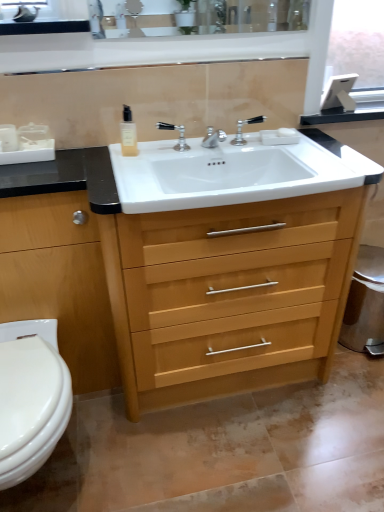
You are a GUI agent. You are given a task and a screenshot of the screen. Output one action in this format:
    pyautogui.click(x=<x>, y=<y>)
    Task: Click on the free space that is in between light wood/finish chest of drawers at left and white glossy toilet at lower left
    Image resolution: width=384 pixels, height=512 pixels.
    Given the screenshot: What is the action you would take?
    pyautogui.click(x=101, y=437)